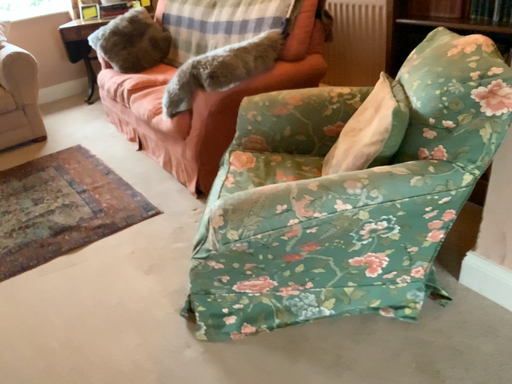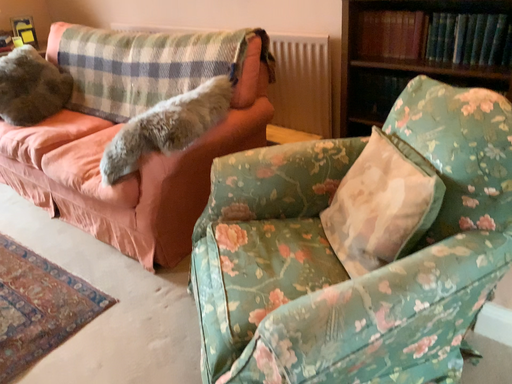
Question: Which way did the camera rotate in the video?

Choices:
 (A) rotated left
 (B) rotated right

Answer: (B)